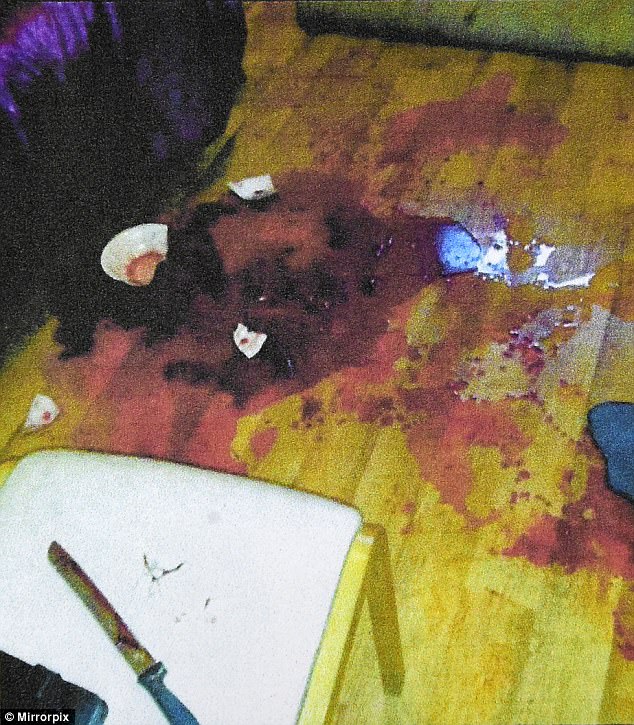
Where is `wooden floor board`? The image size is (634, 725). wooden floor board is located at coordinates (477, 678).